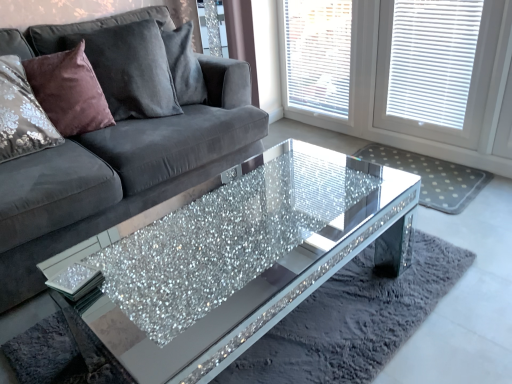
Question: Can you confirm if white textured blinds at upper right is wider than sparkly glass coffee table at center?

Choices:
 (A) no
 (B) yes

Answer: (A)

Question: From the image's perspective, is white textured blinds at upper right below sparkly glass coffee table at center?

Choices:
 (A) yes
 (B) no

Answer: (B)

Question: Is white textured blinds at upper right aimed at sparkly glass coffee table at center?

Choices:
 (A) yes
 (B) no

Answer: (A)

Question: Is sparkly glass coffee table at center located within white textured blinds at upper right?

Choices:
 (A) yes
 (B) no

Answer: (B)

Question: Does white textured blinds at upper right appear on the left side of sparkly glass coffee table at center?

Choices:
 (A) no
 (B) yes

Answer: (A)

Question: Considering the relative sizes of white textured blinds at upper right and sparkly glass coffee table at center in the image provided, is white textured blinds at upper right shorter than sparkly glass coffee table at center?

Choices:
 (A) yes
 (B) no

Answer: (B)

Question: From a real-world perspective, is white textured blind at upper right under white dotted mat at center?

Choices:
 (A) yes
 (B) no

Answer: (B)

Question: Can you confirm if white textured blind at upper right is taller than white dotted mat at center?

Choices:
 (A) no
 (B) yes

Answer: (B)

Question: Is white textured blind at upper right at the left side of white dotted mat at center?

Choices:
 (A) yes
 (B) no

Answer: (B)

Question: Is white textured blind at upper right not close to white dotted mat at center?

Choices:
 (A) yes
 (B) no

Answer: (B)

Question: From the image's perspective, does white textured blind at upper right appear higher than white dotted mat at center?

Choices:
 (A) no
 (B) yes

Answer: (B)

Question: Can we say white textured blind at upper right lies outside white dotted mat at center?

Choices:
 (A) yes
 (B) no

Answer: (A)

Question: From the image's perspective, is white textured blinds at upper right below white dotted mat at center?

Choices:
 (A) no
 (B) yes

Answer: (A)